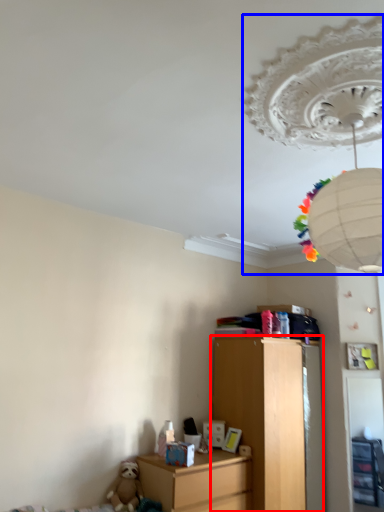
Question: Which object appears closest to the camera in this image, chest of drawers (highlighted by a red box) or lamp (highlighted by a blue box)?

Choices:
 (A) chest of drawers
 (B) lamp

Answer: (B)